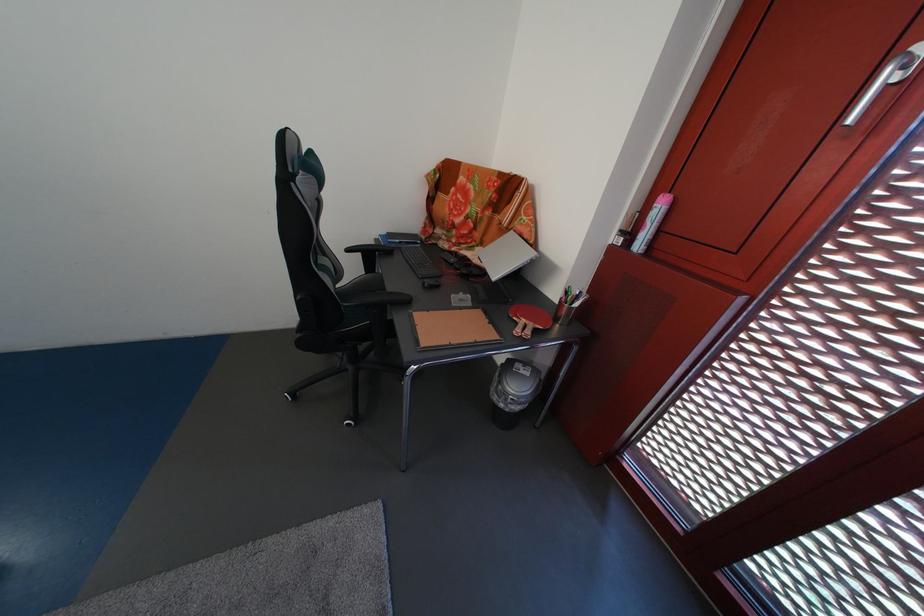
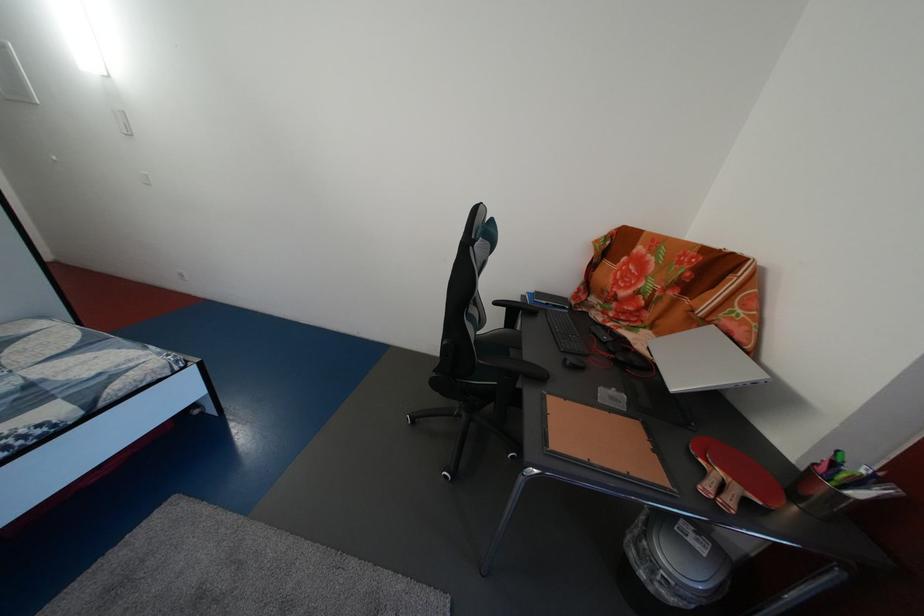
Locate, in the second image, the point that corresponds to the point at 578,299 in the first image.

(845, 471)